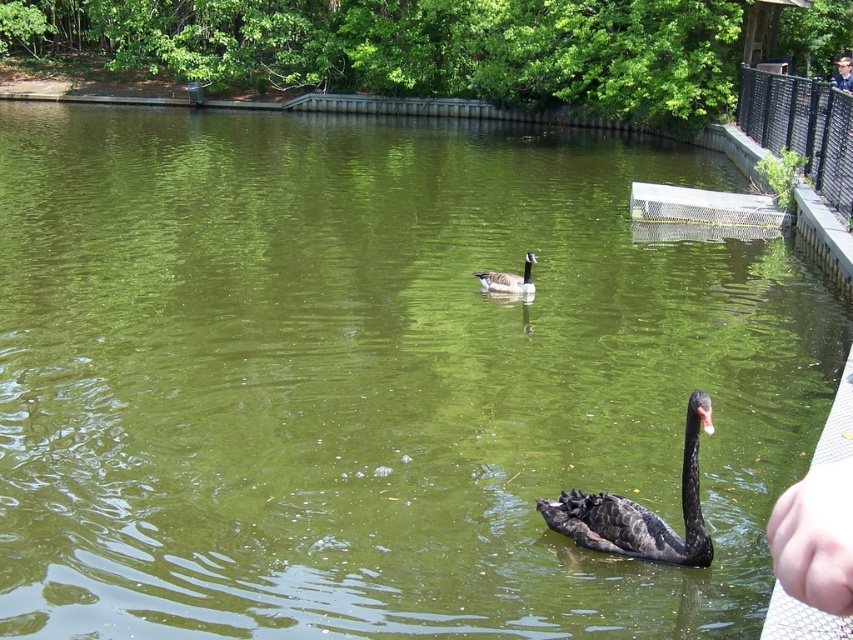
Can you confirm if black glossy swan at lower right is positioned above brown matte goose at center?

No, black glossy swan at lower right is not above brown matte goose at center.

Is point (648, 552) in front of point (527, 289)?

Yes, point (648, 552) is in front of point (527, 289).

Find the location of a particular element. The width and height of the screenshot is (853, 640). black glossy swan at lower right is located at coordinates (640, 509).